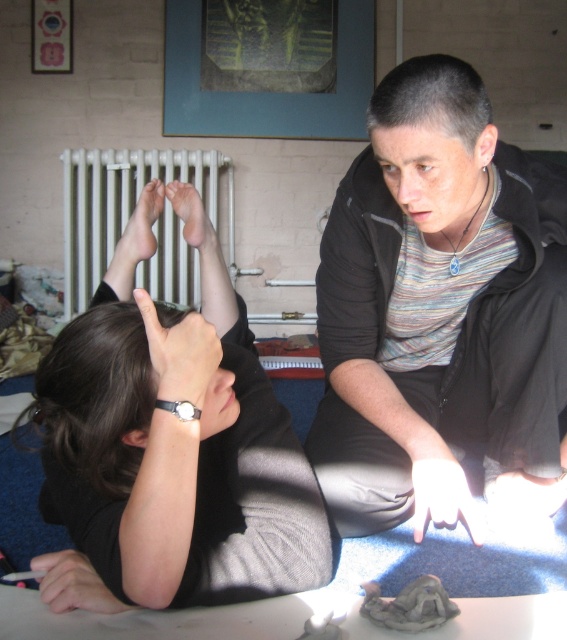
Does black matte sweater at upper left have a greater height compared to matte white hand at lower center?

Correct, black matte sweater at upper left is much taller as matte white hand at lower center.

Can you confirm if black matte sweater at upper left is shorter than matte white hand at lower center?

No, black matte sweater at upper left is not shorter than matte white hand at lower center.

The image size is (567, 640). Identify the location of black matte sweater at upper left. (176, 452).

Can you confirm if white metallic radiator at upper center is bigger than smooth skin hand at lower left?

Correct, white metallic radiator at upper center is larger in size than smooth skin hand at lower left.

Can you confirm if white metallic radiator at upper center is positioned above smooth skin hand at lower left?

Correct, white metallic radiator at upper center is located above smooth skin hand at lower left.

Which is in front, point (162, 160) or point (90, 609)?

Point (90, 609)

At what (x,y) coordinates should I click in order to perform the action: click on white metallic radiator at upper center. Please return your answer as a coordinate pair (x, y). This screenshot has width=567, height=640. Looking at the image, I should click on (125, 205).

Which of these two, matte white hand at lower center or matte skin feet at upper center, stands shorter?

matte white hand at lower center

What do you see at coordinates (526, 493) in the screenshot? The image size is (567, 640). I see `matte white hand at lower center` at bounding box center [526, 493].

You are a GUI agent. You are given a task and a screenshot of the screen. Output one action in this format:
    pyautogui.click(x=<x>, y=<y>)
    Task: Click on the matte white hand at lower center
    This screenshot has width=567, height=640.
    Given the screenshot: What is the action you would take?
    pyautogui.click(x=526, y=493)